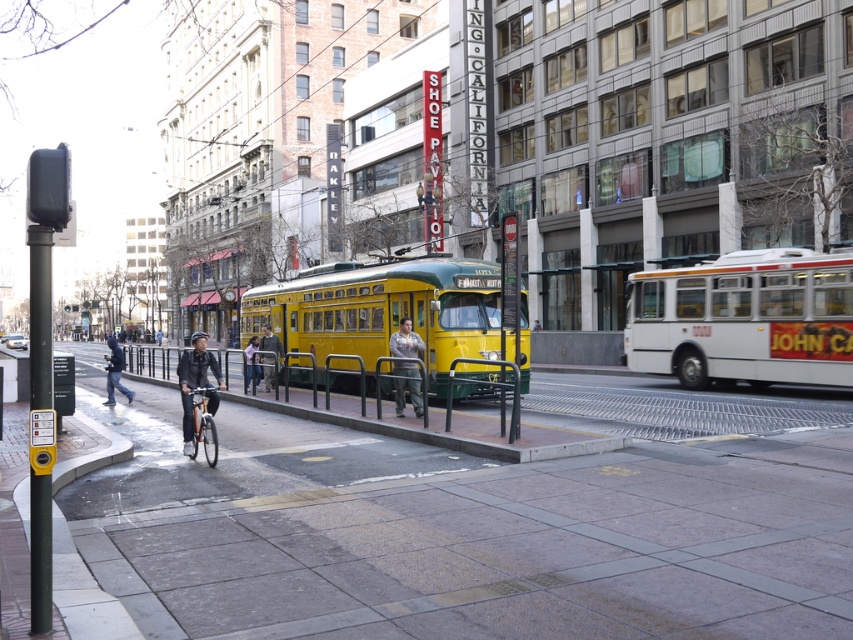
In the scene shown: Can you confirm if gray fabric jacket at center is positioned to the right of dark blue jacket at center?

Yes, gray fabric jacket at center is to the right of dark blue jacket at center.

From the picture: Can you confirm if gray fabric jacket at center is shorter than dark blue jacket at center?

No, gray fabric jacket at center is not shorter than dark blue jacket at center.

This screenshot has width=853, height=640. What are the coordinates of `gray fabric jacket at center` in the screenshot? It's located at (407, 387).

Where is `white matte bus at right`? This screenshot has height=640, width=853. white matte bus at right is located at coordinates (746, 317).

Which is below, white matte bus at right or orange metallic bicycle at lower left?

orange metallic bicycle at lower left is below.

I want to click on white matte bus at right, so click(x=746, y=317).

The width and height of the screenshot is (853, 640). I want to click on white matte bus at right, so click(x=746, y=317).